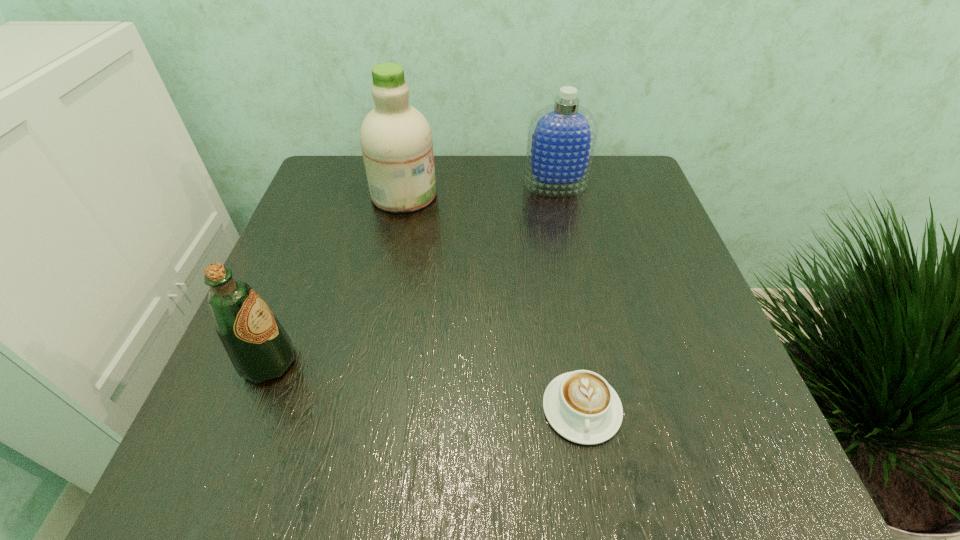
Where is `empty location between the olive oil and the shortest object`? empty location between the olive oil and the shortest object is located at coordinates (425, 386).

Select which object is the closest to the taller cleansing agent. Please provide its 2D coordinates. Your answer should be formatted as a tuple, i.e. [(x, y)], where the tuple contains the x and y coordinates of a point satisfying the conditions above.

[(562, 136)]

Select which object appears as the second closest to the shortest object. Please provide its 2D coordinates. Your answer should be formatted as a tuple, i.e. [(x, y)], where the tuple contains the x and y coordinates of a point satisfying the conditions above.

[(396, 140)]

The image size is (960, 540). Identify the location of vacant area that satisfies the following two spatial constraints: 1. on the front side of the shorter cleansing agent; 2. on the front label of the taller cleansing agent. (558, 194).

At what (x,y) coordinates should I click in order to perform the action: click on free space that satisfies the following two spatial constraints: 1. on the front side of the right cleansing agent; 2. on the front-facing side of the leftmost object. Please return your answer as a coordinate pair (x, y). This screenshot has height=540, width=960. Looking at the image, I should click on coord(592,362).